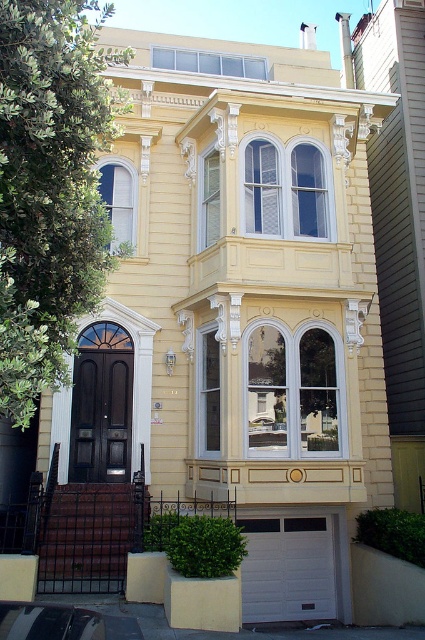
Question: From the image, what is the correct spatial relationship of white glass window at center in relation to matte white window at upper left?

Choices:
 (A) below
 (B) above

Answer: (B)

Question: Which point is farther from the camera taking this photo?

Choices:
 (A) (198, 200)
 (B) (269, 387)
 (C) (158, 52)
 (D) (299, 148)

Answer: (C)

Question: Among these points, which one is nearest to the camera?

Choices:
 (A) (329, 189)
 (B) (212, 198)

Answer: (A)

Question: Can you confirm if white glass window at center is thinner than clear glass window at center?

Choices:
 (A) no
 (B) yes

Answer: (A)

Question: Is white glass window at center bigger than matte white window at upper left?

Choices:
 (A) yes
 (B) no

Answer: (A)

Question: Among these points, which one is farthest from the camera?

Choices:
 (A) (198, 211)
 (B) (130, 228)
 (C) (163, 61)
 (D) (286, 192)

Answer: (C)